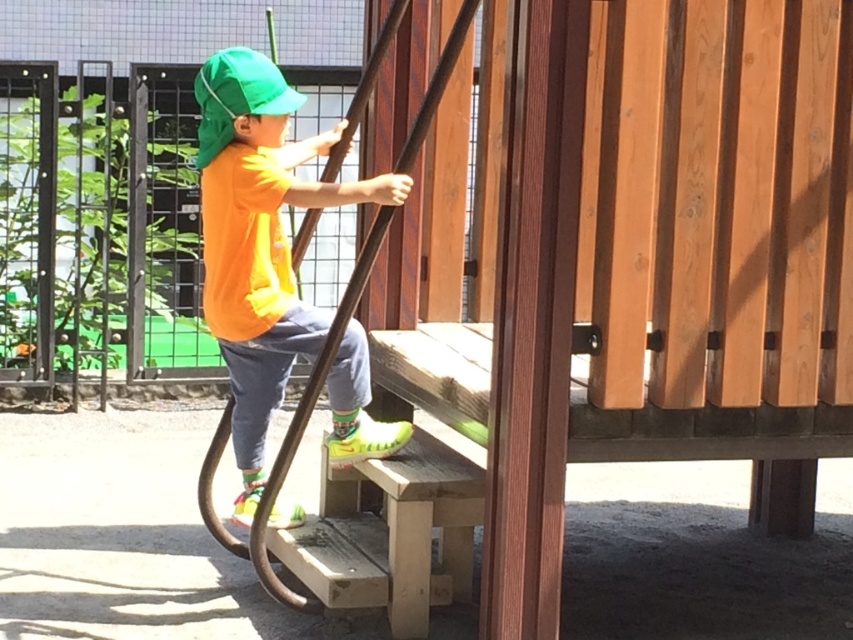
Question: Which point appears farthest from the camera in this image?

Choices:
 (A) (277, 97)
 (B) (283, 97)

Answer: (B)

Question: Among these objects, which one is farthest from the camera?

Choices:
 (A) matte orange shirt at center
 (B) green fabric cap at upper left

Answer: (B)

Question: Is matte orange shirt at center smaller than green fabric cap at upper left?

Choices:
 (A) no
 (B) yes

Answer: (A)

Question: Can you confirm if matte orange shirt at center is smaller than green fabric cap at upper left?

Choices:
 (A) no
 (B) yes

Answer: (A)

Question: Among these objects, which one is nearest to the camera?

Choices:
 (A) matte orange shirt at center
 (B) green fabric cap at upper left

Answer: (A)

Question: From the image, what is the correct spatial relationship of matte orange shirt at center in relation to green fabric cap at upper left?

Choices:
 (A) below
 (B) above

Answer: (A)